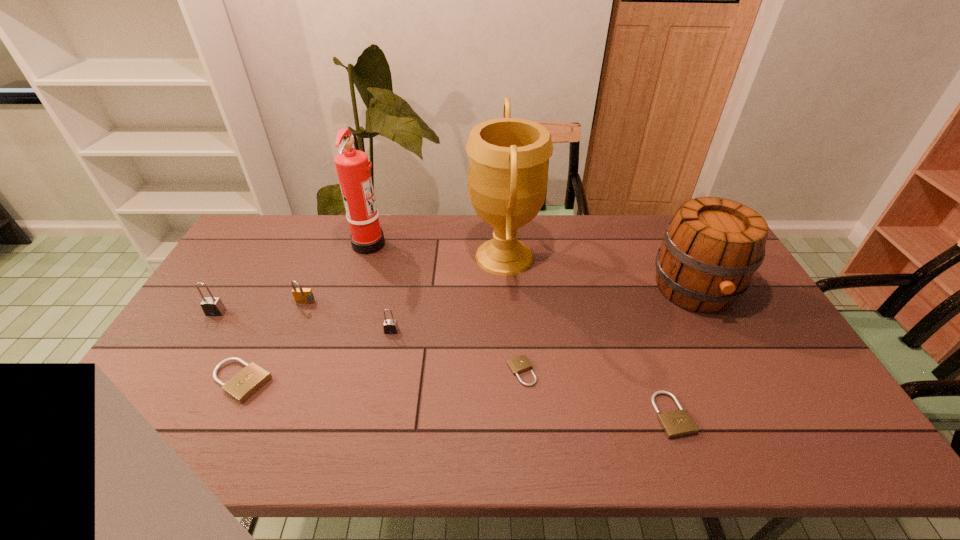
What are the coordinates of `the fourth tallest padlock` in the screenshot? It's located at (250, 379).

At what (x,y) coordinates should I click in order to perform the action: click on the leftmost beige padlock. Please return your answer as a coordinate pair (x, y). The image size is (960, 540). Looking at the image, I should click on (250, 379).

Locate an element on the screen. the second shortest padlock is located at coordinates (677, 423).

Identify the location of the rightmost beige padlock. The image size is (960, 540). (677, 423).

Where is `the shortest object`? the shortest object is located at coordinates (519, 364).

The image size is (960, 540). Identify the location of the second beige padlock from right to left. (519, 364).

The height and width of the screenshot is (540, 960). I want to click on free spot located 0.300m on the engravings side of the trophy, so click(380, 256).

I want to click on free space located on the engravings side of the trophy, so 444,256.

Find the location of a particular element. vacant space situated 0.070m on the engravings side of the trophy is located at coordinates (447, 256).

The height and width of the screenshot is (540, 960). I want to click on vacant region located at the nozzle of the fourth object from left to right, so click(472, 243).